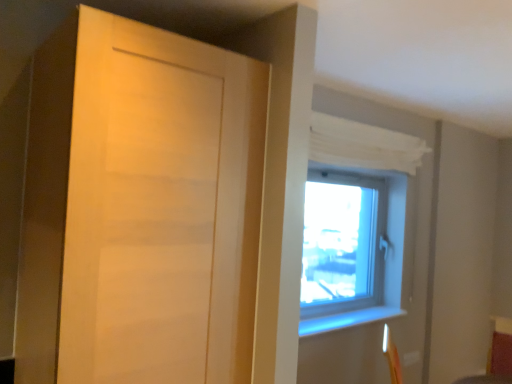
Question: From a real-world perspective, is white sheer curtain at upper right physically above matte wood door at left?

Choices:
 (A) no
 (B) yes

Answer: (B)

Question: Can you confirm if white sheer curtain at upper right is positioned to the left of matte wood door at left?

Choices:
 (A) no
 (B) yes

Answer: (A)

Question: Can you confirm if white sheer curtain at upper right is bigger than matte wood door at left?

Choices:
 (A) yes
 (B) no

Answer: (B)

Question: From the image's perspective, is white sheer curtain at upper right located beneath matte wood door at left?

Choices:
 (A) yes
 (B) no

Answer: (B)

Question: From the image's perspective, is white sheer curtain at upper right over matte wood door at left?

Choices:
 (A) yes
 (B) no

Answer: (A)

Question: Does white sheer curtain at upper right have a smaller size compared to matte wood door at left?

Choices:
 (A) yes
 (B) no

Answer: (A)

Question: Is matte wood door at left thinner than white sheer curtain at upper right?

Choices:
 (A) no
 (B) yes

Answer: (A)

Question: Are matte wood door at left and white sheer curtain at upper right located far from each other?

Choices:
 (A) no
 (B) yes

Answer: (B)

Question: Is matte wood door at left outside white sheer curtain at upper right?

Choices:
 (A) yes
 (B) no

Answer: (A)

Question: Does matte wood door at left turn towards white sheer curtain at upper right?

Choices:
 (A) yes
 (B) no

Answer: (B)

Question: From the image's perspective, is matte wood door at left under white sheer curtain at upper right?

Choices:
 (A) yes
 (B) no

Answer: (A)

Question: From the image's perspective, would you say matte wood door at left is positioned over white sheer curtain at upper right?

Choices:
 (A) no
 (B) yes

Answer: (A)

Question: From the image's perspective, is white sheer curtain at upper right located above or below matte wood door at left?

Choices:
 (A) below
 (B) above

Answer: (B)